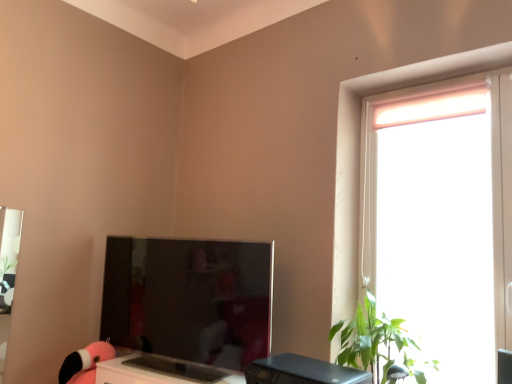
Find the location of a particular element. green leafy plant at right is located at coordinates (375, 343).

This screenshot has width=512, height=384. What do you see at coordinates (470, 201) in the screenshot?
I see `translucent plastic window at right` at bounding box center [470, 201].

Identify the location of black plastic desktop at lower center. The width and height of the screenshot is (512, 384). (302, 371).

Between satin black monitor at center and matte pink plush at lower left, which one is positioned behind?

Positioned behind is matte pink plush at lower left.

From a real-world perspective, which is physically below, satin black monitor at center or matte pink plush at lower left?

From a 3D spatial view, matte pink plush at lower left is below.

Is satin black monitor at center wider or thinner than matte pink plush at lower left?

Clearly, satin black monitor at center has less width compared to matte pink plush at lower left.

Based on the photo, in terms of height, does satin black monitor at center look taller or shorter compared to green leafy plant at right?

satin black monitor at center is taller than green leafy plant at right.

Looking at their sizes, would you say satin black monitor at center is wider or thinner than green leafy plant at right?

Clearly, satin black monitor at center has less width compared to green leafy plant at right.

From the image's perspective, which is below, satin black monitor at center or green leafy plant at right?

green leafy plant at right appears lower in the image.

From the picture: From the image's perspective, relative to satin black monitor at center, is translucent plastic window at right above or below?

From the image's perspective, translucent plastic window at right appears above satin black monitor at center.

Looking at this image, is the position of translucent plastic window at right more distant than that of satin black monitor at center?

No, it is in front of satin black monitor at center.

Considering the relative positions of translucent plastic window at right and satin black monitor at center in the image provided, is translucent plastic window at right to the right of satin black monitor at center from the viewer's perspective?

Correct, you'll find translucent plastic window at right to the right of satin black monitor at center.

Who is taller, translucent plastic window at right or satin black monitor at center?

translucent plastic window at right.

Could you tell me if green leafy plant at right is turned towards matte pink plush at lower left?

No, green leafy plant at right is not facing towards matte pink plush at lower left.

Between green leafy plant at right and matte pink plush at lower left, which one appears on the left side from the viewer's perspective?

matte pink plush at lower left.

Considering the relative sizes of green leafy plant at right and matte pink plush at lower left in the image provided, is green leafy plant at right wider than matte pink plush at lower left?

Yes.

Looking at this image, relative to matte pink plush at lower left, is translucent plastic window at right in front or behind?

Visually, translucent plastic window at right is located in front of matte pink plush at lower left.

Considering the sizes of objects translucent plastic window at right and matte pink plush at lower left in the image provided, who is taller, translucent plastic window at right or matte pink plush at lower left?

Standing taller between the two is translucent plastic window at right.

Which object is positioned more to the right, translucent plastic window at right or matte pink plush at lower left?

translucent plastic window at right.

Can we say translucent plastic window at right lies outside matte pink plush at lower left?

Absolutely, translucent plastic window at right is external to matte pink plush at lower left.

Image resolution: width=512 pixels, height=384 pixels. Identify the location of window on the right side of black plastic desktop at lower center. (470, 201).

Is point (344, 381) farther from viewer compared to point (483, 193)?

No, it is in front of (483, 193).

Would you say black plastic desktop at lower center is a long distance from translucent plastic window at right?

No, black plastic desktop at lower center is not far from translucent plastic window at right.

Considering the sizes of objects black plastic desktop at lower center and translucent plastic window at right in the image provided, who is shorter, black plastic desktop at lower center or translucent plastic window at right?

black plastic desktop at lower center is shorter.

Find the location of a particular element. houseplant above the matte pink plush at lower left (from a real-world perspective) is located at coordinates (375, 343).

Can you tell me how much matte pink plush at lower left and green leafy plant at right differ in facing direction?

The angular difference between matte pink plush at lower left and green leafy plant at right is 21.3 degrees.

Can you confirm if matte pink plush at lower left is thinner than green leafy plant at right?

Yes, matte pink plush at lower left is thinner than green leafy plant at right.

At what (x,y) coordinates should I click in order to perform the action: click on computer monitor in front of the matte pink plush at lower left. Please return your answer as a coordinate pair (x, y). This screenshot has height=384, width=512. Looking at the image, I should click on (189, 299).

The image size is (512, 384). In order to click on computer monitor located behind the green leafy plant at right in this screenshot , I will do `click(189, 299)`.

From the image, which object appears to be nearer to black plastic desktop at lower center, translucent plastic window at right or satin black monitor at center?

The object closer to black plastic desktop at lower center is satin black monitor at center.

Based on their spatial positions, is green leafy plant at right or black plastic desktop at lower center further from translucent plastic window at right?

The object further to translucent plastic window at right is black plastic desktop at lower center.

Considering their positions, is green leafy plant at right positioned closer to matte pink plush at lower left than satin black monitor at center?

Based on the image, satin black monitor at center appears to be nearer to matte pink plush at lower left.

From the image, which object appears to be nearer to matte pink plush at lower left, black plastic desktop at lower center or satin black monitor at center?

satin black monitor at center lies closer to matte pink plush at lower left than the other object.

When comparing their distances from satin black monitor at center, does translucent plastic window at right or green leafy plant at right seem further?

translucent plastic window at right is positioned further to the anchor satin black monitor at center.

When comparing their distances from black plastic desktop at lower center, does satin black monitor at center or matte pink plush at lower left seem closer?

Among the two, satin black monitor at center is located nearer to black plastic desktop at lower center.

Based on their spatial positions, is translucent plastic window at right or black plastic desktop at lower center further from satin black monitor at center?

The object further to satin black monitor at center is translucent plastic window at right.

Which object lies further to the anchor point green leafy plant at right, satin black monitor at center or black plastic desktop at lower center?

satin black monitor at center is positioned further to the anchor green leafy plant at right.

Locate an element on the screen. Image resolution: width=512 pixels, height=384 pixels. desktop situated between matte pink plush at lower left and green leafy plant at right from left to right is located at coordinates (302, 371).

At what (x,y) coordinates should I click in order to perform the action: click on desktop located between satin black monitor at center and translucent plastic window at right in the left-right direction. Please return your answer as a coordinate pair (x, y). This screenshot has height=384, width=512. Looking at the image, I should click on (302, 371).

Locate an element on the screen. The image size is (512, 384). houseplant between matte pink plush at lower left and translucent plastic window at right is located at coordinates (375, 343).

This screenshot has height=384, width=512. Find the location of `computer monitor between matte pink plush at lower left and translucent plastic window at right`. computer monitor between matte pink plush at lower left and translucent plastic window at right is located at coordinates (189, 299).